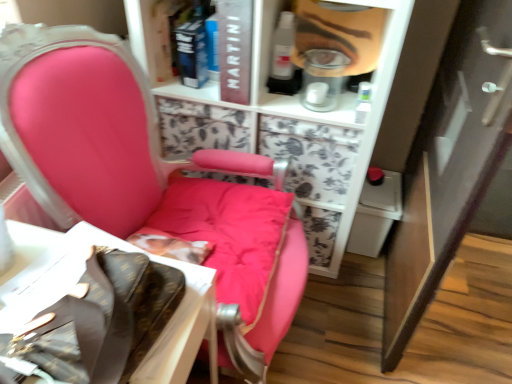
Question: Can you confirm if hardcover book at upper center, which is the first book from left to right, is smaller than matte plastic face at upper center?

Choices:
 (A) yes
 (B) no

Answer: (A)

Question: Is hardcover book at upper center, which is the first book from left to right, positioned behind matte plastic face at upper center?

Choices:
 (A) no
 (B) yes

Answer: (B)

Question: Could you tell me if hardcover book at upper center, which is the first book from left to right, is facing matte plastic face at upper center?

Choices:
 (A) yes
 (B) no

Answer: (B)

Question: Is hardcover book at upper center, which is the first book from left to right, positioned in front of matte plastic face at upper center?

Choices:
 (A) yes
 (B) no

Answer: (B)

Question: From a real-world perspective, is hardcover book at upper center, the 2th book viewed from the right, physically above matte plastic face at upper center?

Choices:
 (A) no
 (B) yes

Answer: (A)

Question: Considering the relative sizes of hardcover book at upper center, the 2th book viewed from the right, and matte plastic face at upper center in the image provided, is hardcover book at upper center, the 2th book viewed from the right, wider than matte plastic face at upper center?

Choices:
 (A) no
 (B) yes

Answer: (B)

Question: Is white cardboard box at lower left taller than matte black book at upper center, which is the second book in left-to-right order?

Choices:
 (A) yes
 (B) no

Answer: (A)

Question: Is white cardboard box at lower left directly adjacent to matte black book at upper center, which appears as the 1th book when viewed from the right?

Choices:
 (A) yes
 (B) no

Answer: (B)

Question: Is white cardboard box at lower left thinner than matte black book at upper center, which appears as the 1th book when viewed from the right?

Choices:
 (A) no
 (B) yes

Answer: (A)

Question: Is matte black book at upper center, which appears as the 1th book when viewed from the right, located within white cardboard box at lower left?

Choices:
 (A) yes
 (B) no

Answer: (B)

Question: Does white cardboard box at lower left have a larger size compared to matte black book at upper center, which appears as the 1th book when viewed from the right?

Choices:
 (A) no
 (B) yes

Answer: (B)

Question: Does white cardboard box at lower left appear on the left side of matte black book at upper center, which is the second book in left-to-right order?

Choices:
 (A) yes
 (B) no

Answer: (A)

Question: Is matte plastic face at upper center bigger than white cardboard box at lower left?

Choices:
 (A) yes
 (B) no

Answer: (B)